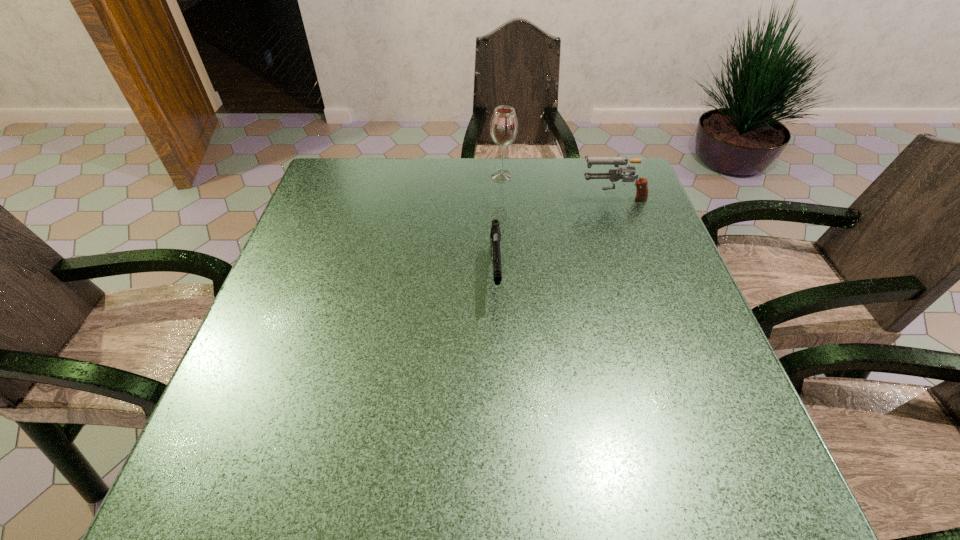
This screenshot has width=960, height=540. Find the location of `vacant position in the image that satisfies the following two spatial constraints: 1. at the barrel end of the second nearest object; 2. at the aiming end of the nearest object`. vacant position in the image that satisfies the following two spatial constraints: 1. at the barrel end of the second nearest object; 2. at the aiming end of the nearest object is located at coordinates (640, 275).

Where is `vacant space that satisfies the following two spatial constraints: 1. at the barrel end of the taller gun; 2. at the aiming end of the nearer gun`? This screenshot has width=960, height=540. vacant space that satisfies the following two spatial constraints: 1. at the barrel end of the taller gun; 2. at the aiming end of the nearer gun is located at coordinates (640, 275).

This screenshot has height=540, width=960. What are the coordinates of `vacant area that satisfies the following two spatial constraints: 1. at the barrel end of the taller gun; 2. at the aiming end of the shorter gun` in the screenshot? It's located at (640, 275).